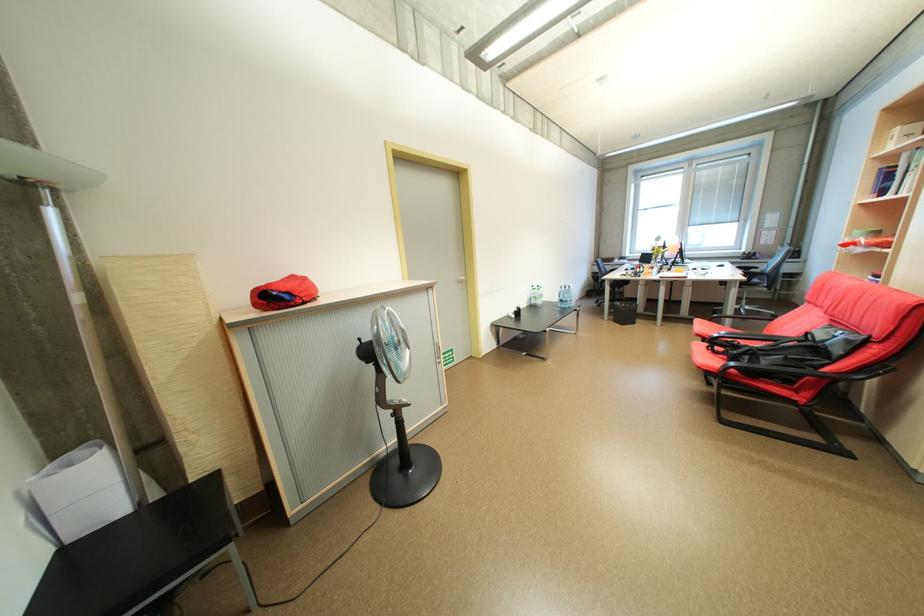
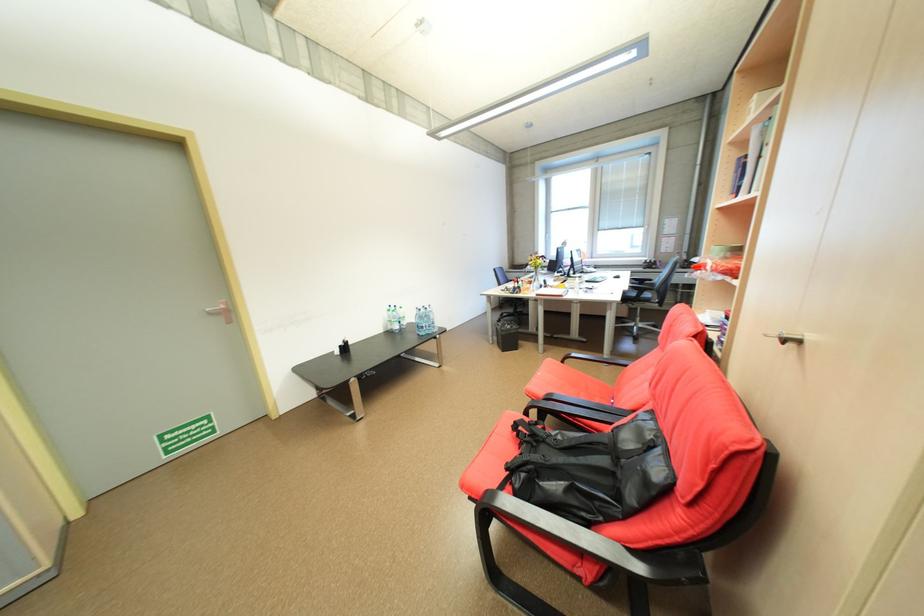
Which direction would the cameraman need to move to produce the second image?

The movement direction of the cameraman is right, forward.